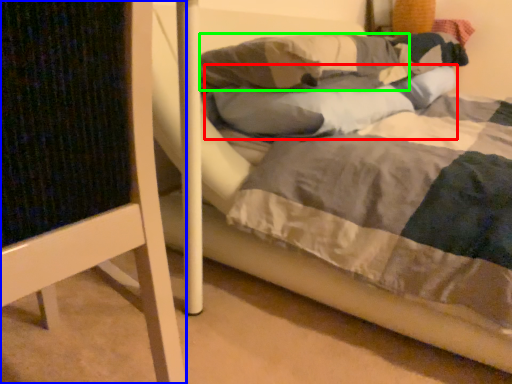
Question: Estimate the real-world distances between objects in this image. Which object is closer to pillow (highlighted by a red box), furniture (highlighted by a blue box) or pillow (highlighted by a green box)?

Choices:
 (A) furniture
 (B) pillow

Answer: (B)